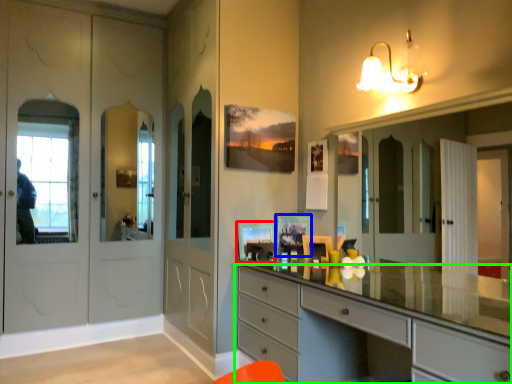
Question: Which object is positioned closest to picture frame (highlighted by a red box)? Select from picture frame (highlighted by a blue box) and chest of drawers (highlighted by a green box).

Choices:
 (A) picture frame
 (B) chest of drawers

Answer: (A)